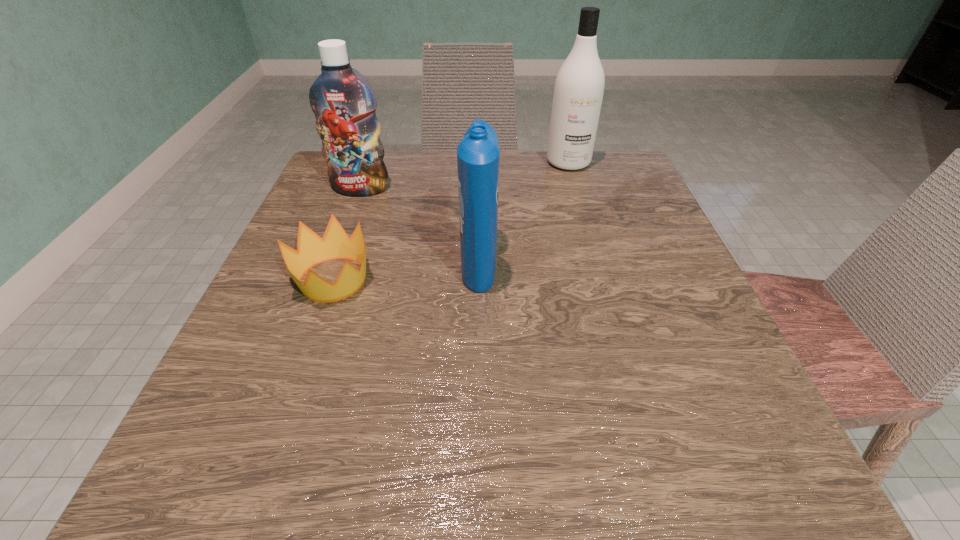
This screenshot has width=960, height=540. Identify the location of the farthest object. (579, 86).

Locate an element on the screen. the rightmost object is located at coordinates (579, 86).

This screenshot has height=540, width=960. In order to click on the leftmost shampoo in this screenshot , I will do `click(344, 104)`.

At what (x,y) coordinates should I click in order to perform the action: click on the second farthest shampoo. Please return your answer as a coordinate pair (x, y). Looking at the image, I should click on (344, 104).

Where is `the third object from left to right`? Image resolution: width=960 pixels, height=540 pixels. the third object from left to right is located at coordinates (478, 154).

Locate an element on the screen. the nearest shampoo is located at coordinates (478, 154).

You are a GUI agent. You are given a task and a screenshot of the screen. Output one action in this format:
    pyautogui.click(x=<x>, y=<y>)
    Task: Click on the shortest object
    
    Given the screenshot: What is the action you would take?
    pyautogui.click(x=311, y=249)

You are a GUI agent. You are given a task and a screenshot of the screen. Output one action in this format:
    pyautogui.click(x=<x>, y=<y>)
    Task: Click on the vacant area situated on the front-facing side of the farthest shampoo
    The image size is (960, 540).
    Given the screenshot: What is the action you would take?
    pyautogui.click(x=596, y=256)

The height and width of the screenshot is (540, 960). I want to click on vacant space situated on the front label of the second nearest shampoo, so click(328, 276).

Find the location of a particular element. The height and width of the screenshot is (540, 960). blank space located 0.230m on the right of the second object from right to left is located at coordinates (623, 263).